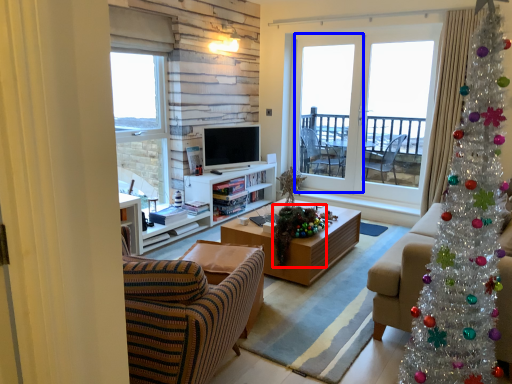
Question: Among these objects, which one is nearest to the camera, christmas decoration (highlighted by a red box) or screen door (highlighted by a blue box)?

Choices:
 (A) christmas decoration
 (B) screen door

Answer: (A)